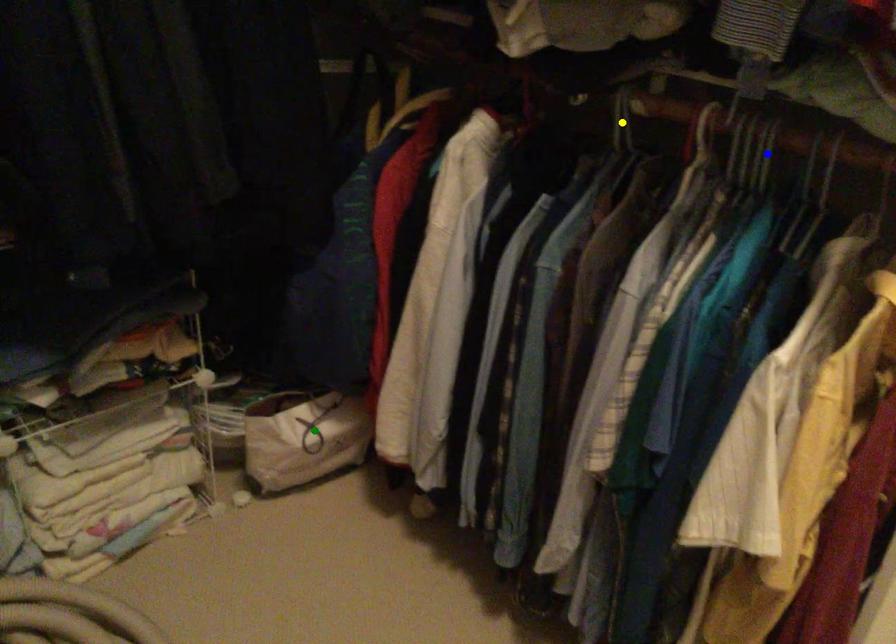
Order these from farthest to nearest:
- blue point
- green point
- yellow point

green point
yellow point
blue point